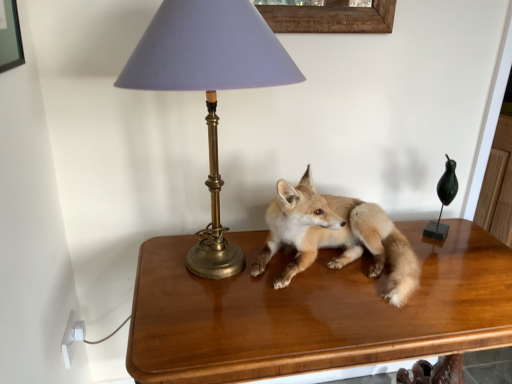
Question: Would you consider light brown fur fox at center to be distant from matte gold lamp at upper left?

Choices:
 (A) no
 (B) yes

Answer: (A)

Question: From the image's perspective, does light brown fur fox at center appear lower than matte gold lamp at upper left?

Choices:
 (A) no
 (B) yes

Answer: (B)

Question: Is light brown fur fox at center thinner than matte gold lamp at upper left?

Choices:
 (A) no
 (B) yes

Answer: (B)

Question: Is the position of light brown fur fox at center less distant than that of matte gold lamp at upper left?

Choices:
 (A) no
 (B) yes

Answer: (A)

Question: From a real-world perspective, is light brown fur fox at center located higher than matte gold lamp at upper left?

Choices:
 (A) no
 (B) yes

Answer: (A)

Question: Is light brown fur fox at center not within matte gold lamp at upper left?

Choices:
 (A) no
 (B) yes

Answer: (B)

Question: Does shiny brown table at center have a larger size compared to matte gold lamp at upper left?

Choices:
 (A) yes
 (B) no

Answer: (A)

Question: Can you confirm if shiny brown table at center is shorter than matte gold lamp at upper left?

Choices:
 (A) no
 (B) yes

Answer: (A)

Question: Considering the relative positions of shiny brown table at center and matte gold lamp at upper left in the image provided, is shiny brown table at center to the right of matte gold lamp at upper left from the viewer's perspective?

Choices:
 (A) yes
 (B) no

Answer: (A)

Question: Is shiny brown table at center to the left of matte gold lamp at upper left from the viewer's perspective?

Choices:
 (A) no
 (B) yes

Answer: (A)

Question: Is shiny brown table at center thinner than matte gold lamp at upper left?

Choices:
 (A) yes
 (B) no

Answer: (B)

Question: From the image's perspective, would you say shiny brown table at center is shown under matte gold lamp at upper left?

Choices:
 (A) no
 (B) yes

Answer: (B)

Question: Is shiny brown table at center placed right next to light brown fur fox at center?

Choices:
 (A) yes
 (B) no

Answer: (B)